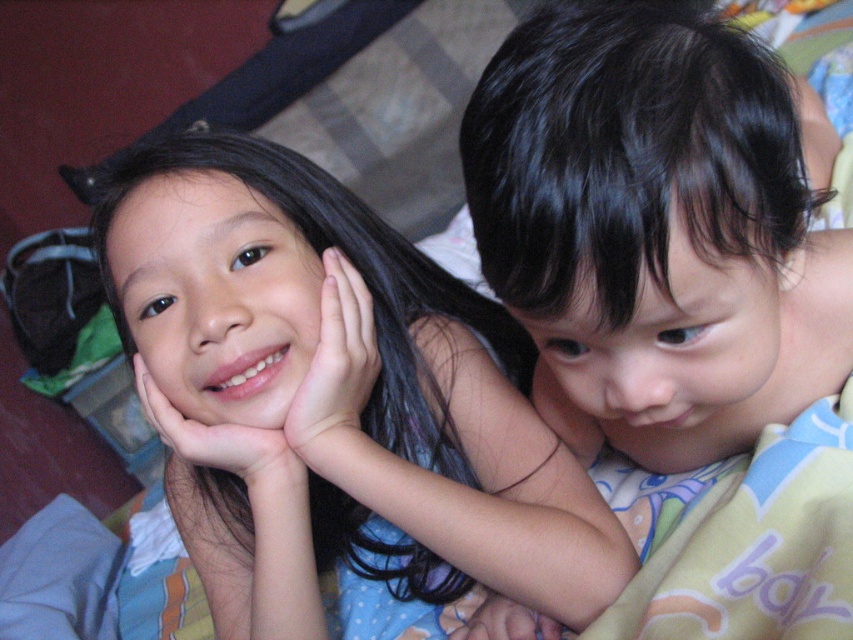
You are a photographer trying to capture a candid shot of the two children. You notice their hands in the frame. Which hand, the smooth skin hand at center or the smooth skin hand at lower right, would appear larger in the photo if both are in focus?

The smooth skin hand at center would appear larger in the photo because it is much taller than the smooth skin hand at lower right, indicating it is closer to the camera and thus appears bigger.